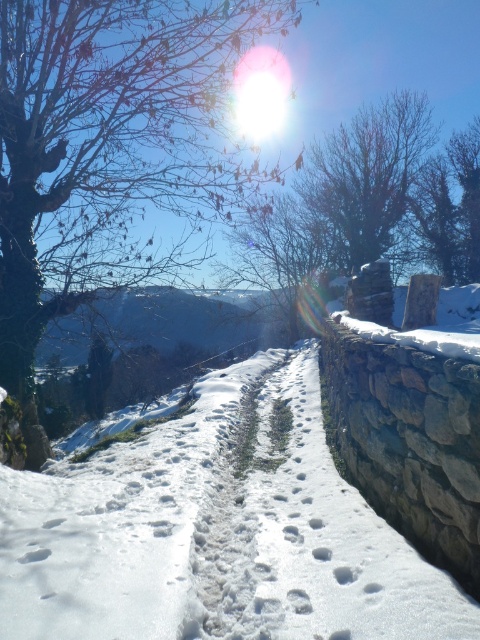
You are standing at the snow path and want to take a photo of both point (241, 152) and point (328, 211). Which point should you focus on first to ensure both are in focus?

You should focus on point (241, 152) first because it is closer to the camera than point (328, 211), ensuring both are within the depth of field.

You are standing at the starting point of the snow path and want to reach the white powdery snow at center. According to the coordinates provided, in which direction should you move relative to your current position?

The white powdery snow at center is located at coordinates point (x=215, y=531). Since you are at the starting point, you should move towards the center of the image where the coordinates indicate the snow is positioned.